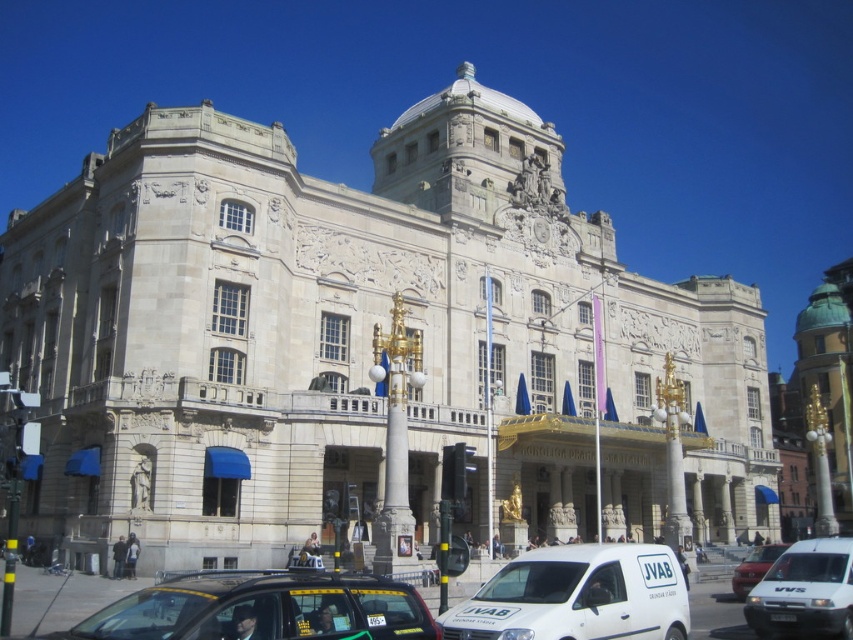
Is point (660, 588) positioned after point (759, 570)?

That is False.

The height and width of the screenshot is (640, 853). Find the location of `white matte van at lower center`. white matte van at lower center is located at coordinates (577, 596).

Locate an element on the screen. Image resolution: width=853 pixels, height=640 pixels. white matte van at lower center is located at coordinates (577, 596).

Does black matte taxi cab at lower left appear on the right side of white matte van at lower center?

In fact, black matte taxi cab at lower left is to the left of white matte van at lower center.

Is point (299, 636) positioned before point (511, 589)?

Yes, point (299, 636) is in front of point (511, 589).

Image resolution: width=853 pixels, height=640 pixels. What are the coordinates of `black matte taxi cab at lower left` in the screenshot? It's located at (262, 609).

Is white matte van at lower center in front of white matte van at lower right?

Yes, white matte van at lower center is in front of white matte van at lower right.

Can you confirm if white matte van at lower center is positioned to the left of white matte van at lower right?

Indeed, white matte van at lower center is positioned on the left side of white matte van at lower right.

Between point (614, 605) and point (842, 596), which one is positioned behind?

The point (842, 596) is behind.

At what (x,y) coordinates should I click in order to perform the action: click on white matte van at lower center. Please return your answer as a coordinate pair (x, y). Looking at the image, I should click on (577, 596).